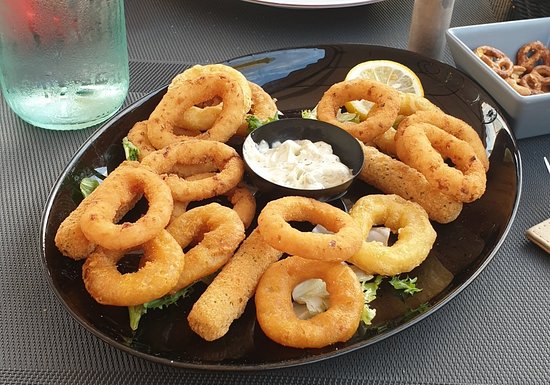
Locate an element on the screen. This screenshot has height=385, width=550. table is located at coordinates (x=494, y=346).